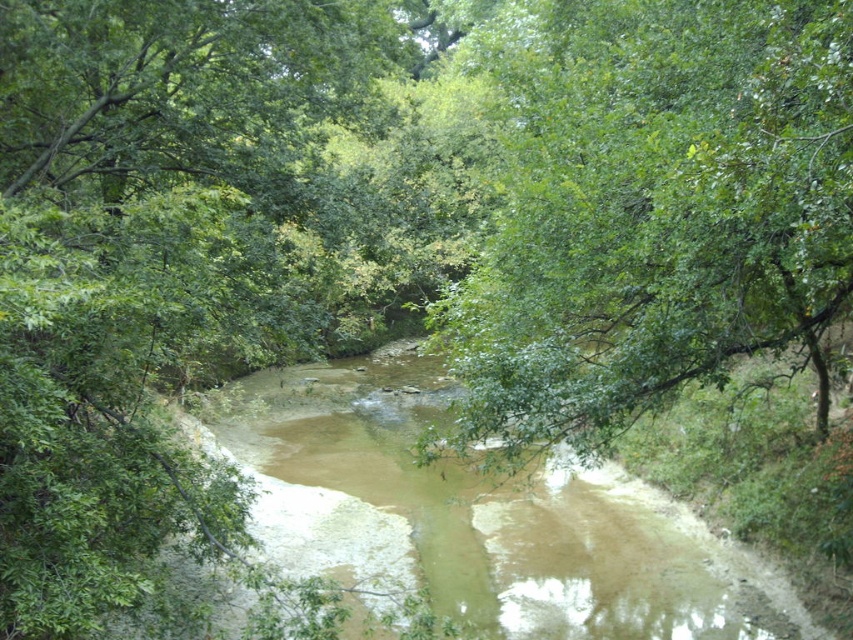
Question: Is green leafy tree at center wider than brown sedimentary water at center?

Choices:
 (A) no
 (B) yes

Answer: (A)

Question: Which object appears farthest from the camera in this image?

Choices:
 (A) brown sedimentary water at center
 (B) green leafy tree at center

Answer: (A)

Question: Can you confirm if green leafy tree at center is bigger than brown sedimentary water at center?

Choices:
 (A) no
 (B) yes

Answer: (B)

Question: Can you confirm if green leafy tree at center is positioned to the left of brown sedimentary water at center?

Choices:
 (A) yes
 (B) no

Answer: (B)

Question: Which object appears closest to the camera in this image?

Choices:
 (A) brown sedimentary water at center
 (B) green leafy tree at center

Answer: (B)